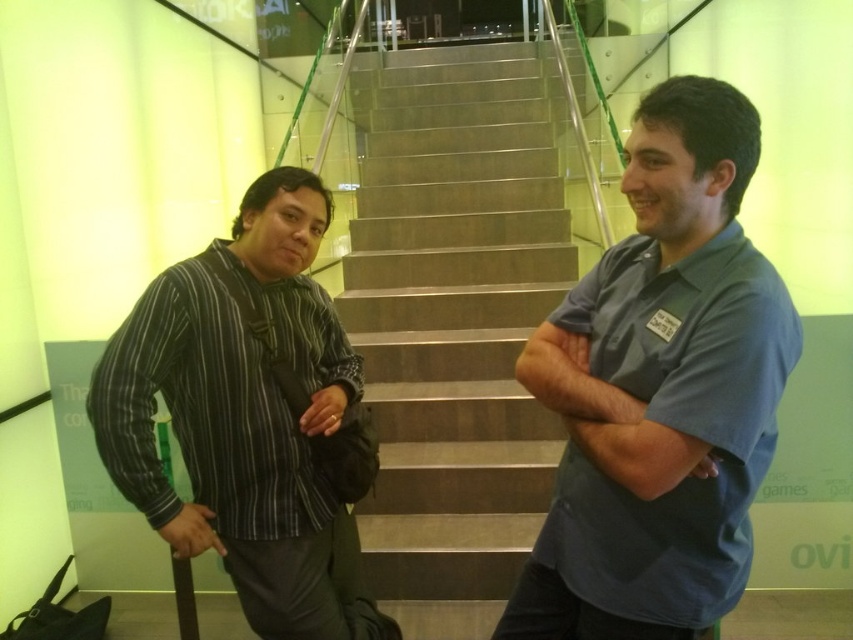
Question: Is metallic staircase at center bigger than striped cotton shirt at left?

Choices:
 (A) no
 (B) yes

Answer: (B)

Question: Which point is farther from the camera taking this photo?

Choices:
 (A) (248, 198)
 (B) (421, 536)

Answer: (B)

Question: Based on their relative distances, which object is farther from the metallic staircase at center?

Choices:
 (A) blue fabric shirt at center
 (B) striped cotton shirt at left

Answer: (A)

Question: Is blue fabric shirt at center thinner than metallic staircase at center?

Choices:
 (A) no
 (B) yes

Answer: (B)

Question: Does blue fabric shirt at center come behind metallic staircase at center?

Choices:
 (A) yes
 (B) no

Answer: (B)

Question: Which of the following is the farthest from the observer?

Choices:
 (A) (537, 172)
 (B) (604, 544)

Answer: (A)